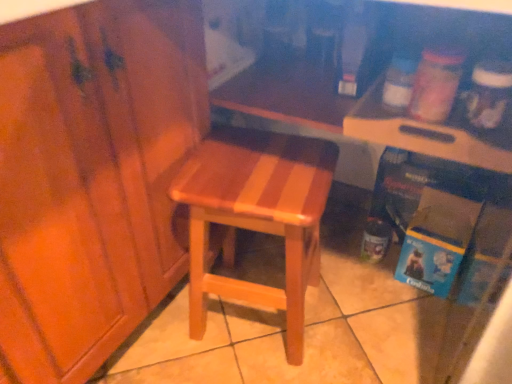
Locate an element on the screen. This screenshot has height=384, width=512. free spot above wooden stool at center (from a real-world perspective) is located at coordinates pos(256,171).